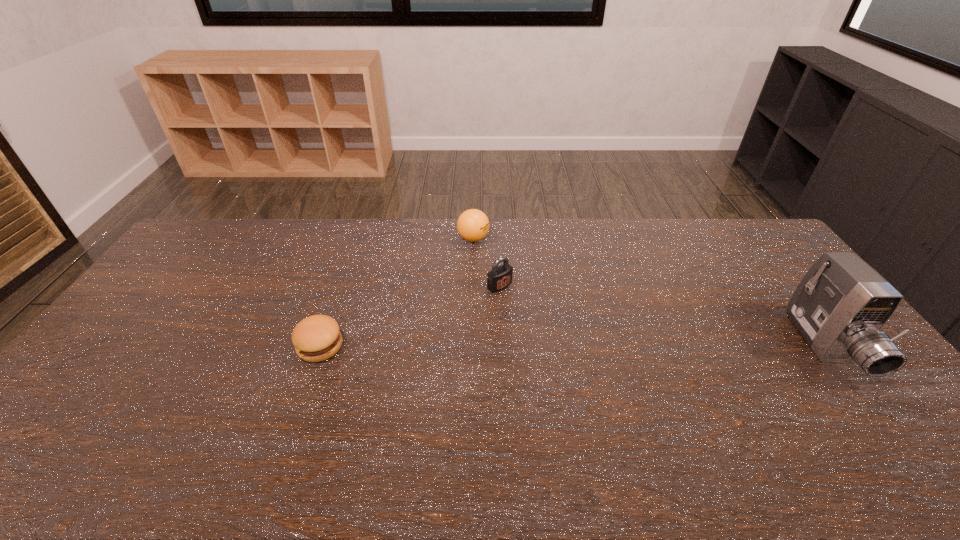
The height and width of the screenshot is (540, 960). Find the location of `free space on the desktop that is between the hamburger and the rightmost object and is positioned on the front of the padlock near the keyhole`. free space on the desktop that is between the hamburger and the rightmost object and is positioned on the front of the padlock near the keyhole is located at coordinates (573, 347).

Identify the location of vacant space on the desktop that is between the shortest object and the camcorder and is positioned on the side with brand of the ping-pong ball. The image size is (960, 540). (612, 347).